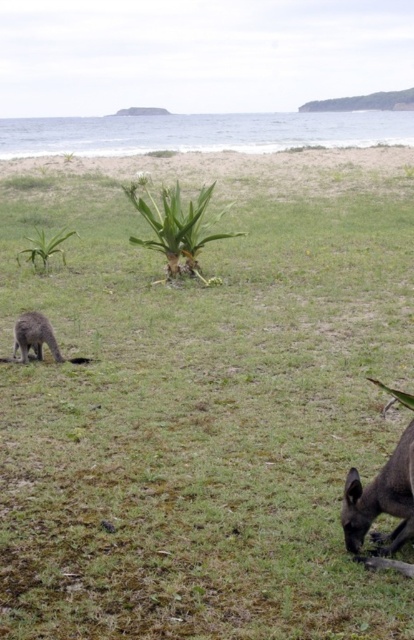
Does brown furry kangaroo at lower right have a lesser width compared to brown fur kangaroo at lower left?

Yes, brown furry kangaroo at lower right is thinner than brown fur kangaroo at lower left.

Is point (394, 538) positioned after point (36, 323)?

That is False.

You are a GUI agent. You are given a task and a screenshot of the screen. Output one action in this format:
    pyautogui.click(x=<x>, y=<y>)
    Task: Click on the brown furry kangaroo at lower right
    
    Given the screenshot: What is the action you would take?
    pyautogui.click(x=382, y=508)